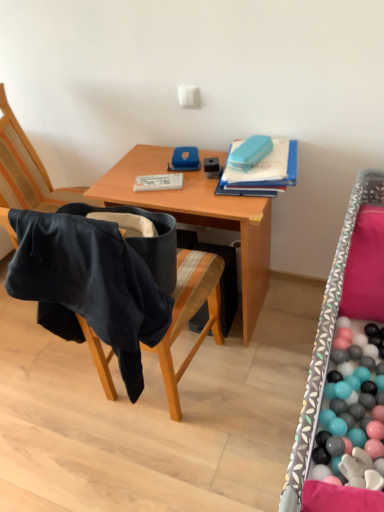
Question: In the image, is black fabric chair at left positioned in front of or behind blue matte folder at upper right?

Choices:
 (A) front
 (B) behind

Answer: (A)

Question: Is point (220, 330) closer or farther from the camera than point (215, 193)?

Choices:
 (A) farther
 (B) closer

Answer: (A)

Question: Based on their relative distances, which object is nearer to the patterned fabric bed frame at right?

Choices:
 (A) wooden desk at center
 (B) blue matte folder at upper right
 (C) black fabric chair at left

Answer: (B)

Question: Estimate the real-world distances between objects in this image. Which object is farther from the black fabric chair at left?

Choices:
 (A) patterned fabric bed frame at right
 (B) wooden desk at center
 (C) blue matte folder at upper right

Answer: (A)